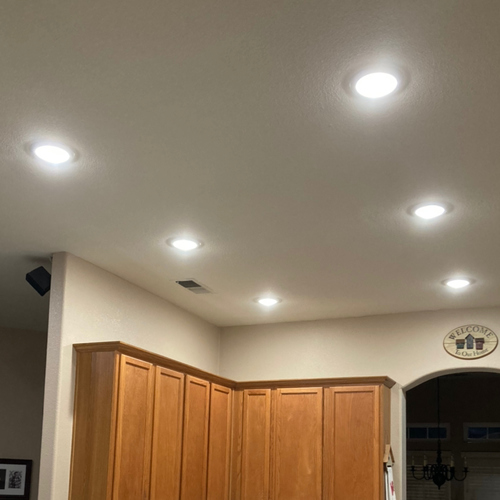
Image resolution: width=500 pixels, height=500 pixels. I want to click on window blinds, so click(x=416, y=488), click(x=481, y=482).